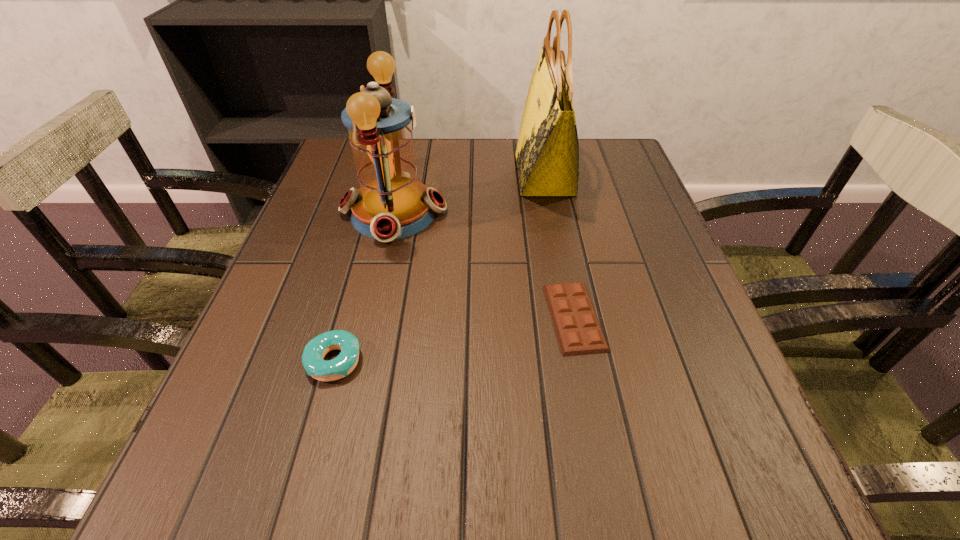
This screenshot has height=540, width=960. Find the location of `free space at the near right corner`. free space at the near right corner is located at coordinates (766, 457).

Identify the location of vacant point located between the third shortest object and the doughnut. 364,287.

The image size is (960, 540). I want to click on vacant space that's between the tote bag and the chocolate bar, so click(x=560, y=246).

Find the location of `vacant space that's between the chocolate bar and the third shortest object`. vacant space that's between the chocolate bar and the third shortest object is located at coordinates (484, 265).

Identify the location of empty space between the second tallest object and the tote bag. This screenshot has width=960, height=540. (469, 193).

Identify the location of free space between the second tallest object and the third tallest object. The width and height of the screenshot is (960, 540). (364, 287).

Where is `free space between the tote bag and the third tallest object`? The width and height of the screenshot is (960, 540). free space between the tote bag and the third tallest object is located at coordinates (440, 267).

Where is `empty location between the third shortest object and the tote bag`? This screenshot has width=960, height=540. empty location between the third shortest object and the tote bag is located at coordinates [469, 193].

The image size is (960, 540). Identify the location of empty space that is in between the tote bag and the second tallest object. (469, 193).

This screenshot has height=540, width=960. In order to click on free area in between the doughnut and the chocolate bar in this screenshot , I will do `click(454, 339)`.